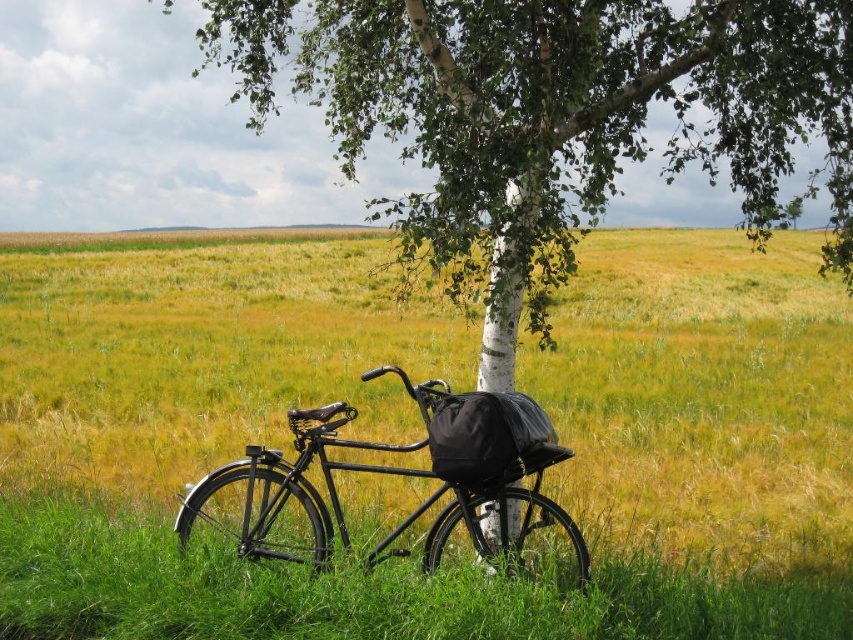
You are a photographer planning to take a photo of the white bark tree at center and the black matte bicycle at center. Since you want both subjects to be clearly visible in the frame, which one should you focus on first to ensure proper depth of field?

The white bark tree at center is bigger than the black matte bicycle at center, so you should focus on the white bark tree at center first to ensure both are in focus.

You are a photographer planning to take a picture of the white bark tree at center and the black matte bicycle at center. Based on their sizes in the image, which object would appear taller in the photo?

The white bark tree at center appears taller in the photo because it has a greater height compared to the black matte bicycle at center.